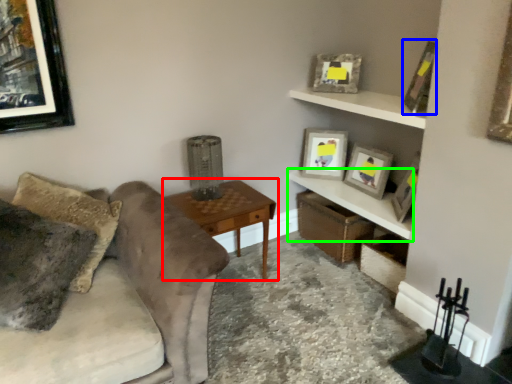
Question: Which is farther away from table (highlighted by a red box)? picture frame (highlighted by a blue box) or shelf (highlighted by a green box)?

Choices:
 (A) picture frame
 (B) shelf

Answer: (A)